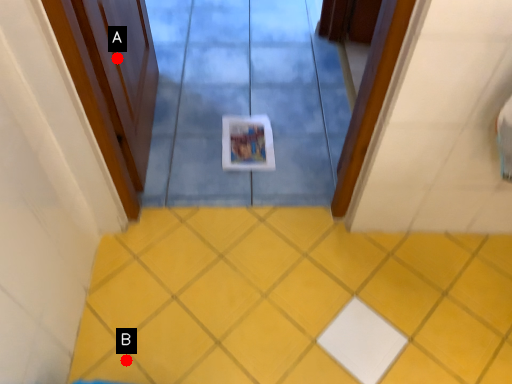
Question: Two points are circled on the image, labeled by A and B beside each circle. Which point is closer to the camera?

Choices:
 (A) A is closer
 (B) B is closer

Answer: (B)